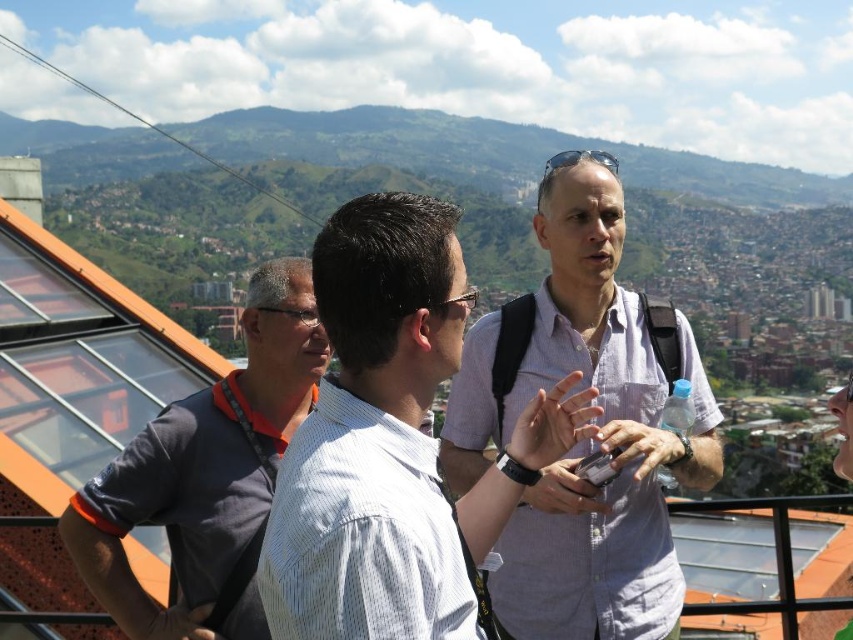
Is white striped shirt at center above gray fabric shirt at left?

Yes, white striped shirt at center is above gray fabric shirt at left.

Which is behind, point (486, 534) or point (77, 492)?

The point (486, 534) is behind.

Measure the distance between point [444,305] and camera.

642.11 meters

This screenshot has height=640, width=853. Find the location of `white striped shirt at center`. white striped shirt at center is located at coordinates (393, 442).

Is point (607, 410) farther from viewer compared to point (186, 536)?

Yes, it is.

Is light purple shirt at center bigger than gray fabric shirt at left?

Indeed, light purple shirt at center has a larger size compared to gray fabric shirt at left.

Between point (595, 221) and point (229, 394), which one is positioned in front?

Positioned in front is point (229, 394).

At what (x,y) coordinates should I click in order to perform the action: click on light purple shirt at center. Please return your answer as a coordinate pair (x, y). This screenshot has height=640, width=853. Looking at the image, I should click on (596, 422).

Find the location of a particular element. white striped shirt at center is located at coordinates (393, 442).

Which of these two, white striped shirt at center or light purple shirt at center, stands taller?

With more height is light purple shirt at center.

The width and height of the screenshot is (853, 640). Describe the element at coordinates (393, 442) in the screenshot. I see `white striped shirt at center` at that location.

Locate an element on the screen. Image resolution: width=853 pixels, height=640 pixels. white striped shirt at center is located at coordinates (393, 442).